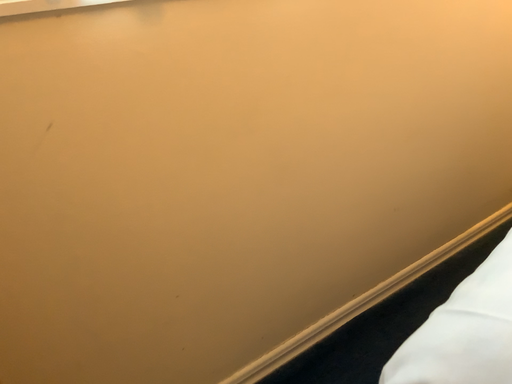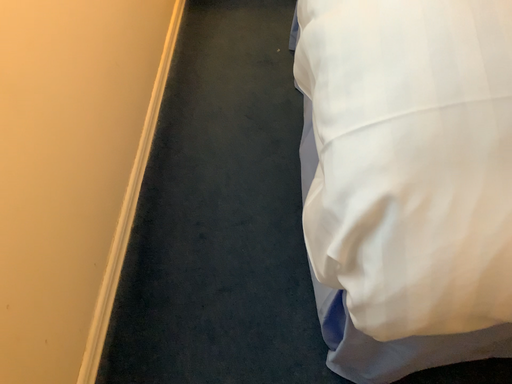
Question: Which way did the camera rotate in the video?

Choices:
 (A) rotated downward
 (B) rotated upward

Answer: (A)